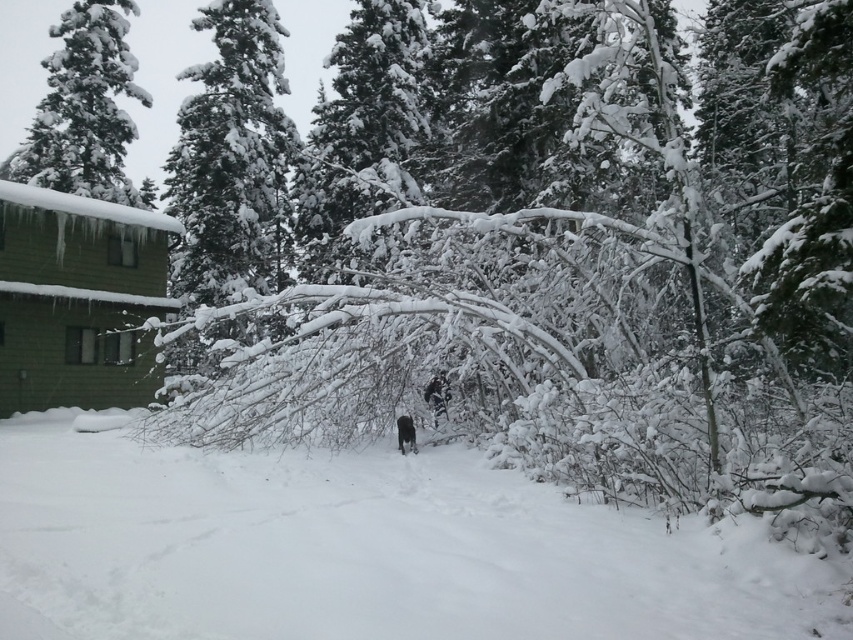
You are standing at the bottom left corner of the image and want to walk towards the white fluffy snow at center. Which direction should you move in?

The white fluffy snow at center is located at point 0.861 on the x axis and 0.429 on the y axis. Since you are at the bottom left corner, moving towards the right and slightly upwards would lead you to the white fluffy snow at center.